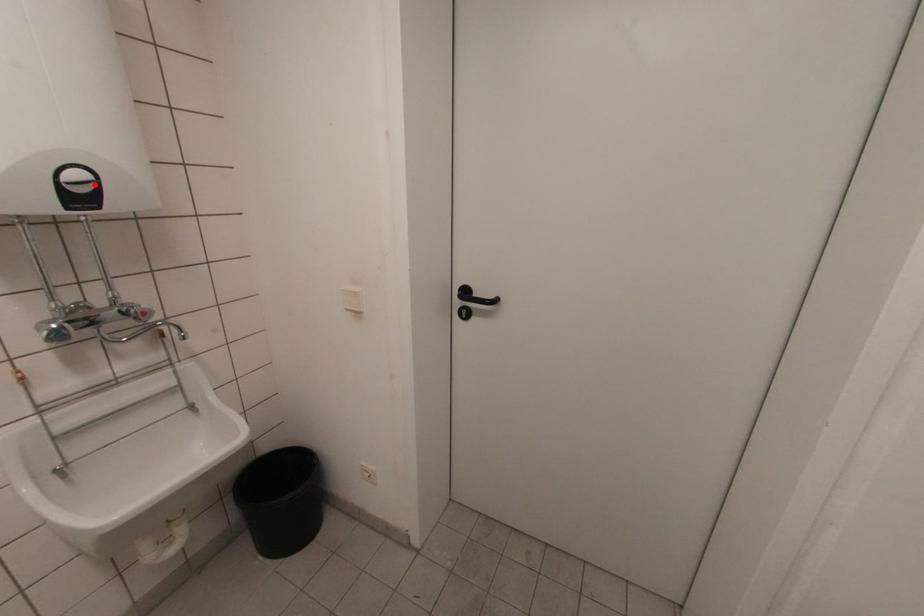
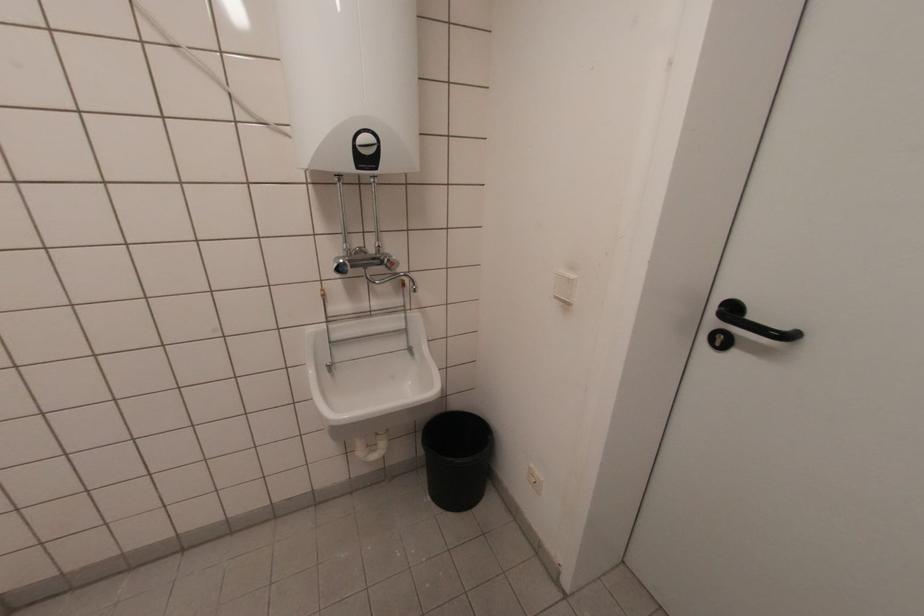
Find the pixel in the second image that matches the highlighted location in the first image.

(377, 148)